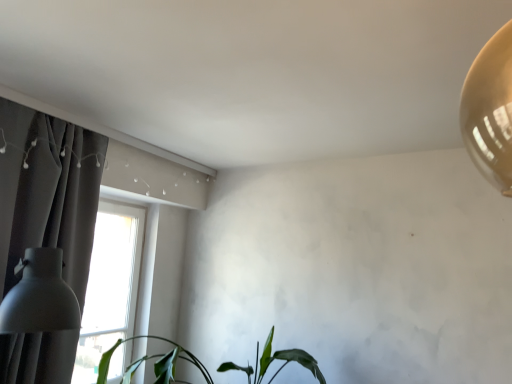
Question: Visually, is green matte plant at lower center positioned to the left or to the right of dark gray fabric curtain at left?

Choices:
 (A) right
 (B) left

Answer: (A)

Question: In the image, is green matte plant at lower center positioned in front of or behind dark gray fabric curtain at left?

Choices:
 (A) behind
 (B) front

Answer: (A)

Question: Which is nearer to the dark gray fabric curtain at left?

Choices:
 (A) matte white lampshade at left
 (B) green matte plant at lower center

Answer: (A)

Question: Which object is the farthest from the matte white lampshade at left?

Choices:
 (A) dark gray fabric curtain at left
 (B) green matte plant at lower center

Answer: (B)